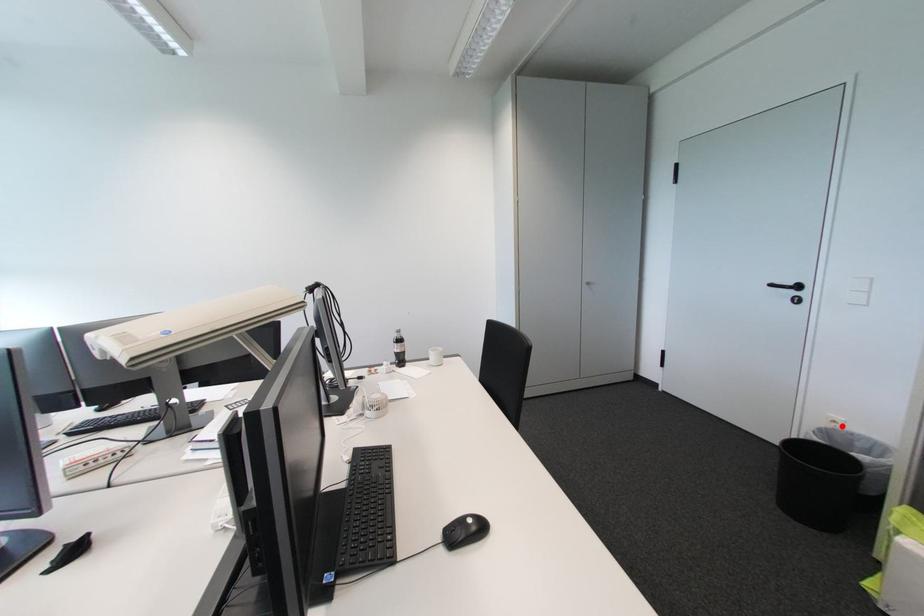
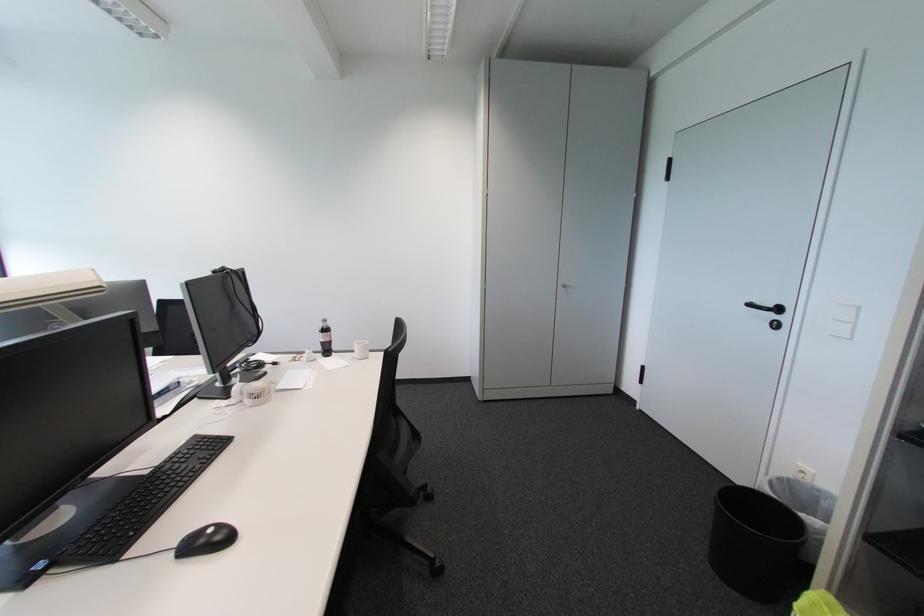
Question: I am providing you with two images of the same scene from different viewpoints. A red point is shown in image1. For the corresponding object point in image2, is it positioned nearer or farther from the camera?

Choices:
 (A) Nearer
 (B) Farther

Answer: (B)